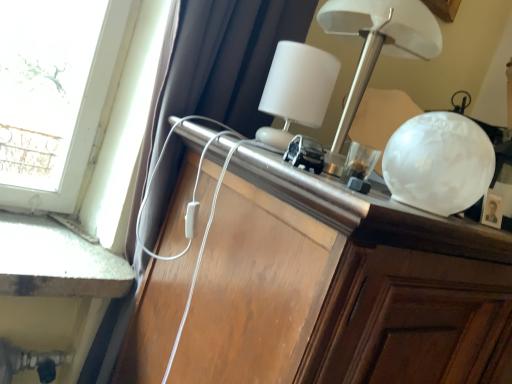
Question: In terms of width, does wooden cabinet at center look wider or thinner when compared to white glossy lamp at upper center?

Choices:
 (A) thin
 (B) wide

Answer: (B)

Question: Is point (407, 374) closer or farther from the camera than point (349, 99)?

Choices:
 (A) closer
 (B) farther

Answer: (A)

Question: Based on their relative distances, which object is nearer to the wooden cabinet at center?

Choices:
 (A) white matte table lamp at upper center
 (B) white glossy lamp at upper center

Answer: (A)

Question: Considering the real-world distances, which object is farthest from the white glossy lamp at upper center?

Choices:
 (A) wooden cabinet at center
 (B) white matte table lamp at upper center

Answer: (A)